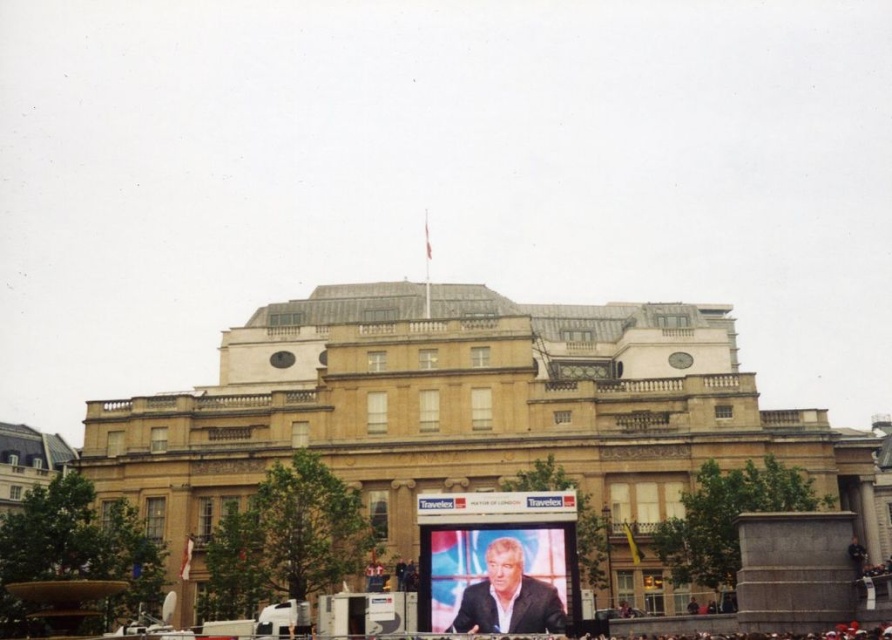
You are standing in front of the golden stone palace at center and the suit at center. Which object is closer to you?

The golden stone palace at center is closer to you since it is further to the viewer than the suit at center.